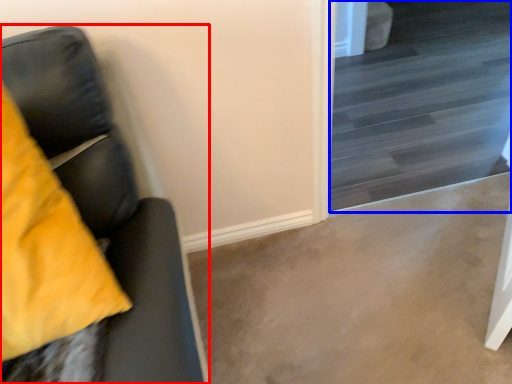
Question: Which point is further to the camera, furniture (highlighted by a red box) or stairwell (highlighted by a blue box)?

Choices:
 (A) furniture
 (B) stairwell

Answer: (B)